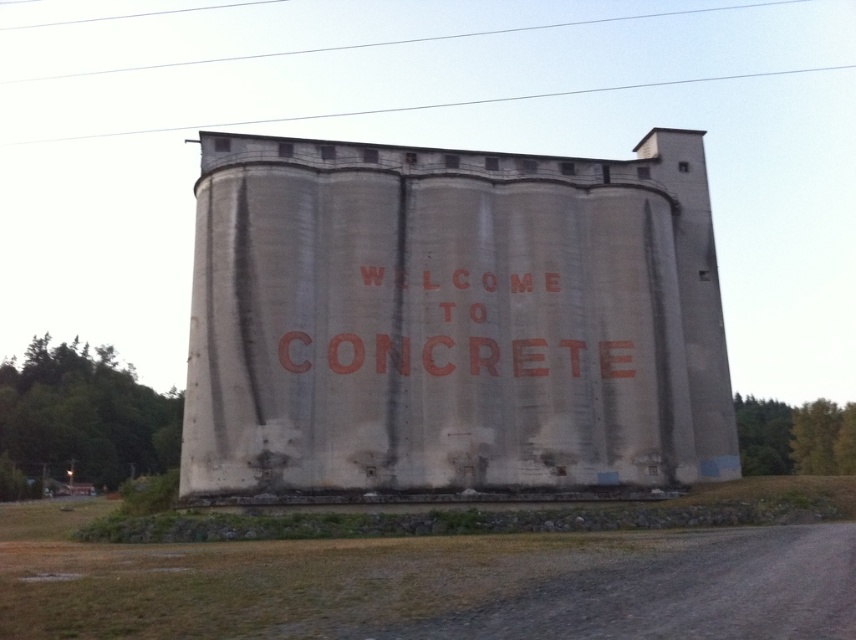
Question: Which point is closer to the camera?

Choices:
 (A) (229, 60)
 (B) (583, 88)
 (C) (419, 460)

Answer: (C)

Question: Is gray concrete silo at center to the right of smooth wire at upper center from the viewer's perspective?

Choices:
 (A) no
 (B) yes

Answer: (B)

Question: Does gray concrete silo at center appear on the left side of smooth white power line at upper center?

Choices:
 (A) no
 (B) yes

Answer: (A)

Question: Which point appears farthest from the camera in this image?

Choices:
 (A) (188, 64)
 (B) (361, 109)

Answer: (A)

Question: Which point is closer to the camera?

Choices:
 (A) (324, 410)
 (B) (502, 32)
 (C) (467, 102)

Answer: (A)

Question: Is gray concrete silo at center positioned in front of smooth wire at upper center?

Choices:
 (A) no
 (B) yes

Answer: (B)